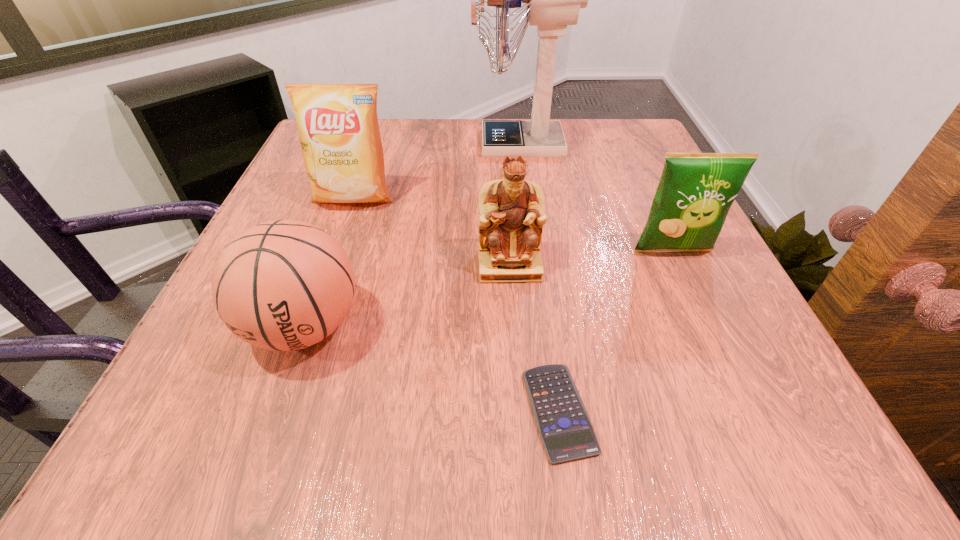
Locate an element on the screen. The image size is (960, 540). free space located on the front-facing side of the farthest object is located at coordinates (361, 144).

Find the location of a particular element. Image resolution: width=960 pixels, height=540 pixels. vacant area situated on the front-facing side of the farthest object is located at coordinates (324, 144).

Identify the location of free space located 0.290m on the front-facing side of the farther crisp (potato chip). Image resolution: width=960 pixels, height=540 pixels. click(308, 329).

This screenshot has width=960, height=540. I want to click on vacant position located on the front-facing side of the figurine, so click(513, 312).

Where is `free region located on the front-facing side of the rightmost object`? free region located on the front-facing side of the rightmost object is located at coordinates (711, 334).

Locate an element on the screen. Image resolution: width=960 pixels, height=540 pixels. free point located 0.060m on the surface of the basketball near the brand logo is located at coordinates (272, 418).

This screenshot has width=960, height=540. Find the location of `blank space located 0.130m on the back of the calculator`. blank space located 0.130m on the back of the calculator is located at coordinates (543, 298).

The width and height of the screenshot is (960, 540). Identify the location of object situated at the far edge. coord(553,0).

You are a GUI agent. You are given a task and a screenshot of the screen. Output one action in this format:
    pyautogui.click(x=<x>, y=<y>)
    Task: Click on the object located at the near edge
    The image size is (960, 540).
    Given the screenshot: What is the action you would take?
    pyautogui.click(x=565, y=428)

Locate an element on the screen. crisp (potato chip) positioned at the left edge is located at coordinates (338, 127).